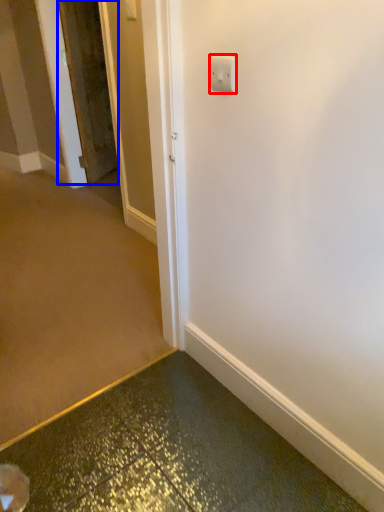
Question: Which of the following is the farthest to the observer, light switch (highlighted by a red box) or door (highlighted by a blue box)?

Choices:
 (A) light switch
 (B) door

Answer: (B)